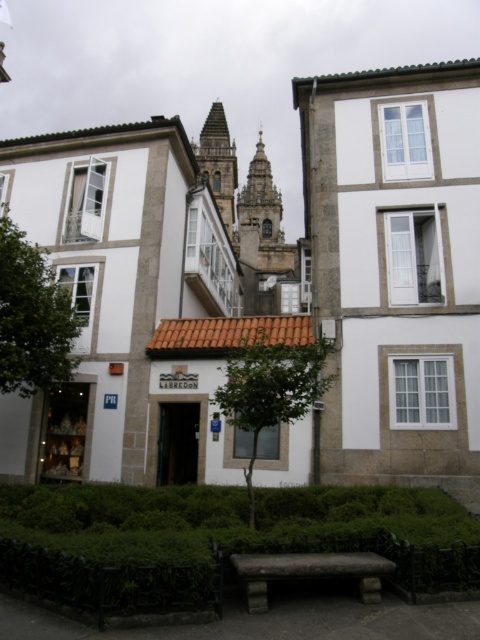
Looking at this image, you are a tourist in this European city and want to sit on the stone textured bench at center to enjoy the view of the green leafy tree at center. Based on the scene, can you sit on the bench and still see the tree?

The stone textured bench at center is behind the green leafy tree at center, so you can sit on the bench and see the tree in front of you.

You are a tourist standing at the base of the green leafy tree at center in the European city scene. You want to visit the brown stone bell tower at upper center. Given that the tree is 497.49 feet away from the tower, is this distance within a 500 feet walking limit imposed by your travel app?

The green leafy tree at center is 497.49 feet away from the brown stone bell tower at upper center. Since 497.49 feet is less than 500 feet, the distance is within the walking limit imposed by your travel app.

You are a tourist standing in the square between the two buildings. You want to take a photo of the brown stone bell tower at upper center without the green leafy tree at left blocking the view. Where should you position yourself to ensure the tree doesn not obstruct the tower?

To avoid the green leafy tree at left blocking the view of the brown stone bell tower at upper center, position yourself to the right side of the square. Since the tree is located below the tower, moving to the right will place the tree out of the frame or behind the tower in your line of sight.